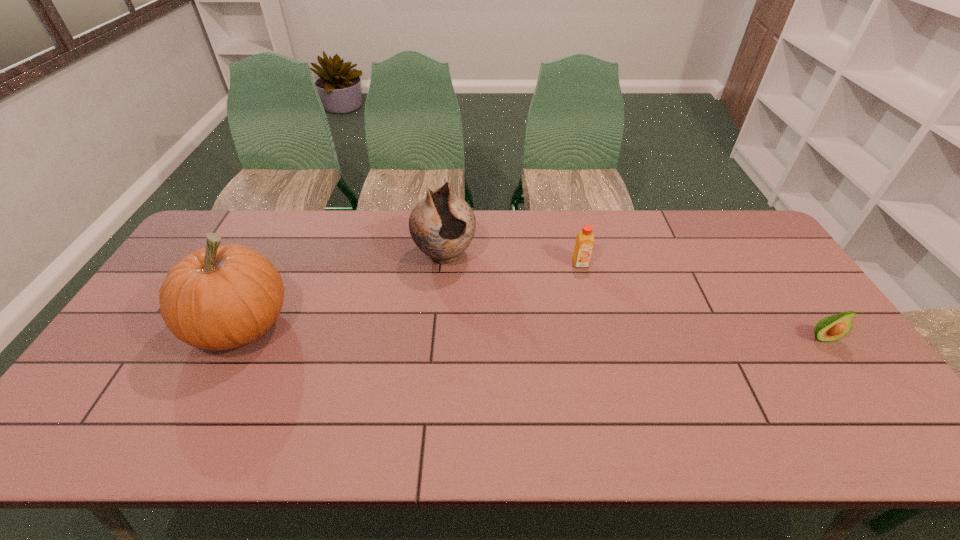
Image resolution: width=960 pixels, height=540 pixels. What are the coordinates of `pumpkin` in the screenshot? It's located at (221, 297).

I want to click on the rightmost object, so click(x=831, y=328).

You are a GUI agent. You are given a task and a screenshot of the screen. Output one action in this format:
    pyautogui.click(x=<x>, y=<y>)
    Task: Click on the shortest object
    Image resolution: width=960 pixels, height=540 pixels.
    Given the screenshot: What is the action you would take?
    pyautogui.click(x=831, y=328)

The height and width of the screenshot is (540, 960). I want to click on the third tallest object, so click(585, 240).

The height and width of the screenshot is (540, 960). I want to click on the second object from right to left, so click(585, 240).

Locate an element on the screen. pottery is located at coordinates (442, 225).

Locate an element on the screen. The image size is (960, 540). free region located 0.340m on the stem of the leftmost object is located at coordinates (415, 325).

Locate an element on the screen. The image size is (960, 540). free point located 0.150m on the cut side of the rightmost object is located at coordinates (862, 396).

This screenshot has height=540, width=960. Find the location of `free space located 0.160m on the front and back of the second shortest object`. free space located 0.160m on the front and back of the second shortest object is located at coordinates (593, 306).

Identify the location of blank space located on the front and back of the second shortest object. The height and width of the screenshot is (540, 960). (607, 351).